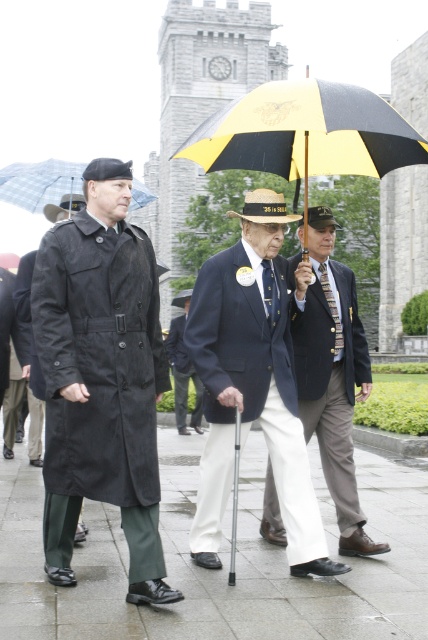
Who is positioned more to the right, smooth concrete pavement at center or black matte trench coat at left?

smooth concrete pavement at center

Locate an element on the screen. smooth concrete pavement at center is located at coordinates (222, 560).

Does point (403, 465) come in front of point (2, 260)?

That is True.

Can you confirm if smooth concrete pavement at center is positioned to the right of blue fabric umbrella at upper left?

Correct, you'll find smooth concrete pavement at center to the right of blue fabric umbrella at upper left.

At what (x,y) coordinates should I click in order to perform the action: click on smooth concrete pavement at center. Please return your answer as a coordinate pair (x, y). Looking at the image, I should click on (222, 560).

Image resolution: width=428 pixels, height=640 pixels. Find the location of `smooth concrete pavement at center`. smooth concrete pavement at center is located at coordinates (222, 560).

Which of these two, white cotton suit at center or dark blue fabric coat at center, stands shorter?

dark blue fabric coat at center

Does point (213, 301) come behind point (193, 381)?

No, (213, 301) is closer to viewer.

Between point (299, 436) and point (175, 410), which one is positioned in front?

Point (299, 436)

The height and width of the screenshot is (640, 428). Identify the location of white cotton suit at center. (252, 384).